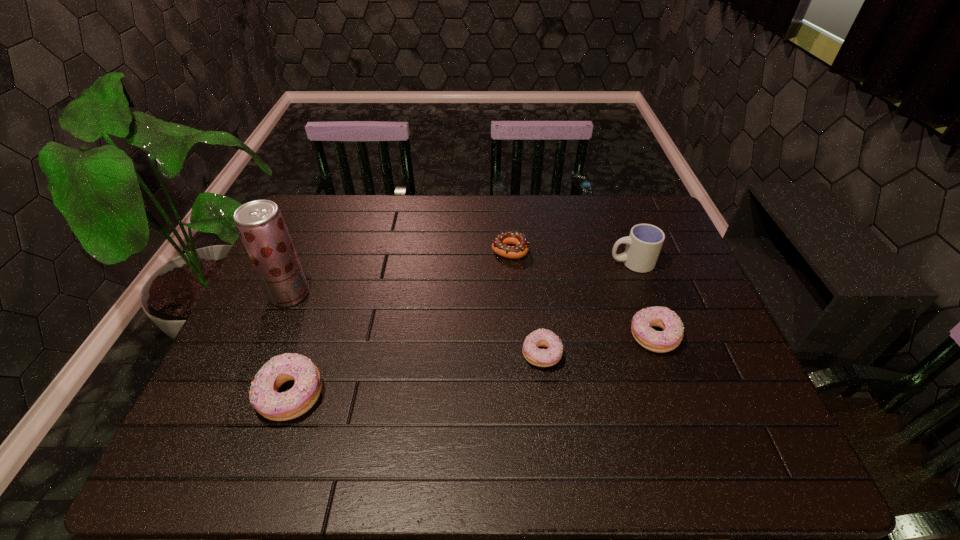
Locate an element on the screen. The width and height of the screenshot is (960, 540). free space located 0.210m on the left of the farthest doughnut is located at coordinates (423, 250).

At what (x,y) coordinates should I click in order to perform the action: click on vacant space located 0.120m on the back of the tallest object. Please return your answer as a coordinate pair (x, y). Looking at the image, I should click on (307, 253).

The width and height of the screenshot is (960, 540). I want to click on vacant area situated 0.330m with the handle on the side of the fifth shortest object, so click(x=498, y=262).

Locate an element on the screen. free location located 0.360m with the handle on the side of the fifth shortest object is located at coordinates (489, 262).

I want to click on vacant area situated with the handle on the side of the fifth shortest object, so click(528, 262).

Locate an element on the screen. The width and height of the screenshot is (960, 540). object situated at the near edge is located at coordinates (264, 397).

The width and height of the screenshot is (960, 540). Identify the location of doughnut that is positioned at the left edge. (264, 397).

In order to click on fruit juice that is at the left edge in this screenshot , I will do tap(260, 224).

The height and width of the screenshot is (540, 960). I want to click on doughnut present at the right edge, so click(x=667, y=340).

This screenshot has height=540, width=960. I want to click on cup present at the right edge, so click(x=644, y=243).